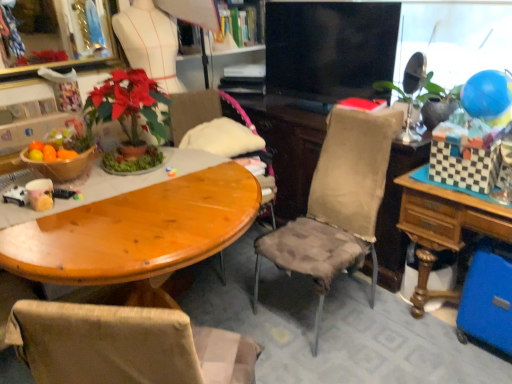
Question: Does blue rubber balloon at upper right turn towards black glossy tv at center?

Choices:
 (A) no
 (B) yes

Answer: (A)

Question: Is blue rubber balloon at upper right wider than black glossy tv at center?

Choices:
 (A) no
 (B) yes

Answer: (B)

Question: Is blue rubber balloon at upper right beside black glossy tv at center?

Choices:
 (A) no
 (B) yes

Answer: (A)

Question: Does blue rubber balloon at upper right have a lesser height compared to black glossy tv at center?

Choices:
 (A) yes
 (B) no

Answer: (A)

Question: From a real-world perspective, is blue rubber balloon at upper right beneath black glossy tv at center?

Choices:
 (A) no
 (B) yes

Answer: (B)

Question: Considering their positions, is wooden chair at center, the 2th chair from the front, located in front of or behind textured beige chair at center, the second chair positioned from the back?

Choices:
 (A) front
 (B) behind

Answer: (B)

Question: Considering the positions of wooden chair at center, the first chair positioned from the back, and textured beige chair at center, the 1th chair in the front-to-back sequence, in the image, is wooden chair at center, the first chair positioned from the back, wider or thinner than textured beige chair at center, the 1th chair in the front-to-back sequence,?

Choices:
 (A) wide
 (B) thin

Answer: (A)

Question: Is wooden chair at center, the first chair positioned from the back, bigger or smaller than textured beige chair at center, the 1th chair in the front-to-back sequence?

Choices:
 (A) small
 (B) big

Answer: (A)

Question: Is wooden chair at center, the 2th chair from the front, inside the boundaries of textured beige chair at center, the second chair positioned from the back, or outside?

Choices:
 (A) outside
 (B) inside

Answer: (A)

Question: From a real-world perspective, is wooden table at right above or below blue rubber balloon at upper right?

Choices:
 (A) above
 (B) below

Answer: (B)

Question: Looking at their shapes, would you say wooden table at right is wider or thinner than blue rubber balloon at upper right?

Choices:
 (A) wide
 (B) thin

Answer: (A)

Question: From the image's perspective, is wooden table at right located above or below blue rubber balloon at upper right?

Choices:
 (A) below
 (B) above

Answer: (A)

Question: Is wooden table at right spatially inside blue rubber balloon at upper right, or outside of it?

Choices:
 (A) inside
 (B) outside

Answer: (B)

Question: Considering the positions of point (229, 100) and point (463, 195), is point (229, 100) closer or farther from the camera than point (463, 195)?

Choices:
 (A) farther
 (B) closer

Answer: (A)

Question: Is wooden chair at center, the 2th chair from the front, taller or shorter than wooden table at right?

Choices:
 (A) short
 (B) tall

Answer: (A)